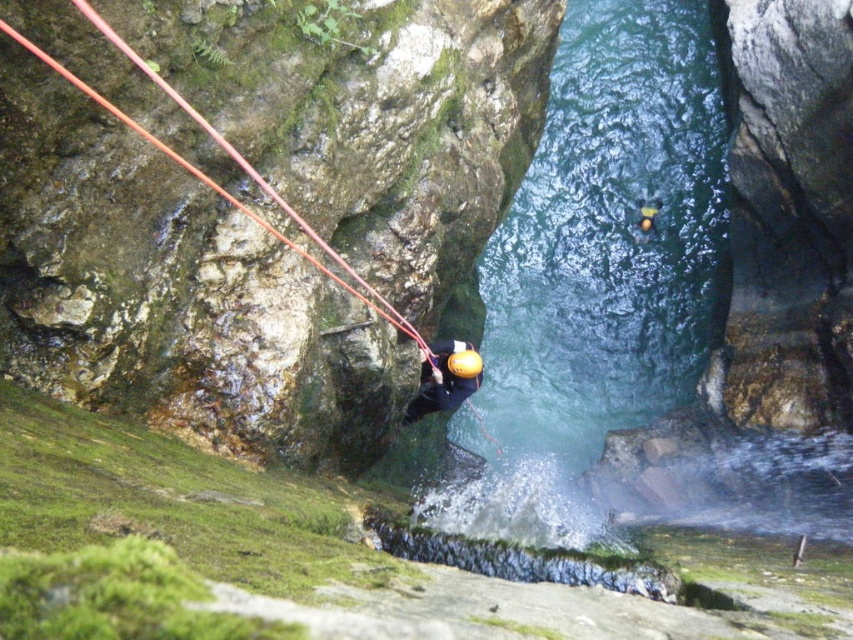
Question: Does clear blue water at center appear on the right side of matte yellow helmet at center?

Choices:
 (A) yes
 (B) no

Answer: (A)

Question: Among these points, which one is nearest to the camera?

Choices:
 (A) (589, 362)
 (B) (78, 84)

Answer: (B)

Question: Which point is closer to the camera?

Choices:
 (A) (553, 106)
 (B) (442, 340)

Answer: (B)

Question: Based on their relative distances, which object is nearer to the clear blue water at center?

Choices:
 (A) smooth red rope at upper left
 (B) matte yellow helmet at center

Answer: (B)

Question: Can you confirm if clear blue water at center is positioned to the right of matte yellow helmet at center?

Choices:
 (A) yes
 (B) no

Answer: (A)

Question: Does clear blue water at center have a greater width compared to matte yellow helmet at center?

Choices:
 (A) no
 (B) yes

Answer: (B)